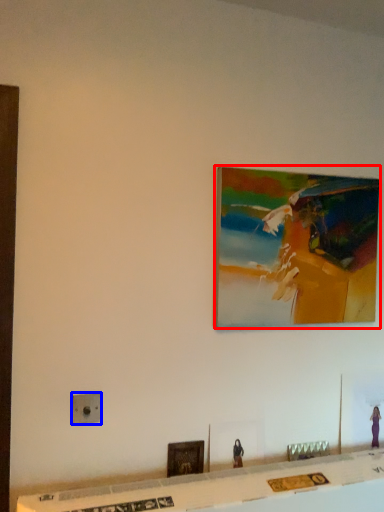
Question: Which point is further to the camera, picture frame (highlighted by a red box) or electric outlet (highlighted by a blue box)?

Choices:
 (A) picture frame
 (B) electric outlet

Answer: (A)